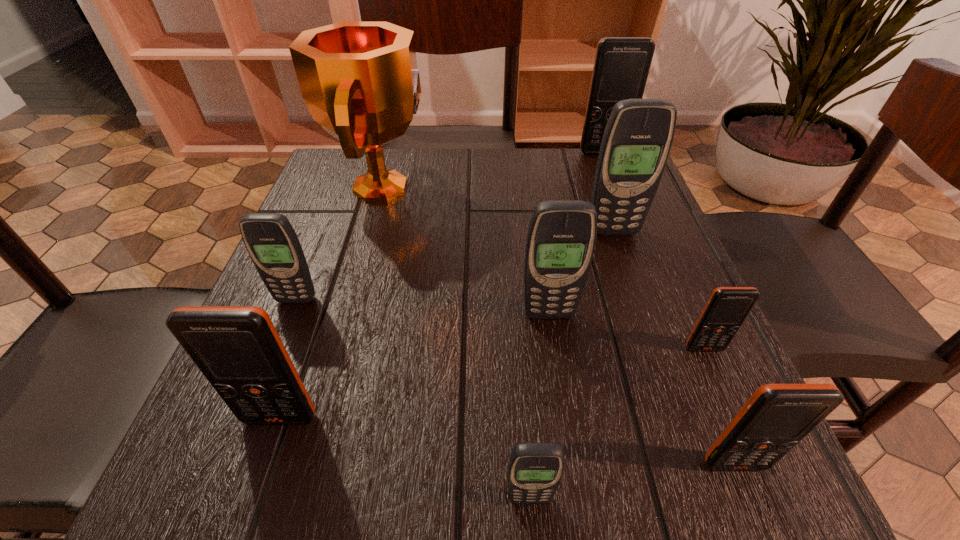
Identify the location of free spot between the sixth nearest cellular telephone and the fourth nearest cellular telephone. (500, 324).

Locate an element on the screen. The height and width of the screenshot is (540, 960). vacant region between the leftmost orange cellular telephone and the fourth farthest cellular telephone is located at coordinates (415, 366).

I want to click on vacant area that lies between the third farthest cellular telephone and the second nearest cellular telephone, so click(516, 382).

Point out which object is positioned as the nearest to the smallest orange cellular telephone. Please provide its 2D coordinates. Your answer should be formatted as a tuple, i.e. [(x, y)], where the tuple contains the x and y coordinates of a point satisfying the conditions above.

[(777, 417)]

Locate an element on the screen. the sixth closest object to the seventh farthest cellular telephone is located at coordinates (359, 80).

Where is `the second closest cellular telephone to the nearest orange cellular telephone`? The image size is (960, 540). the second closest cellular telephone to the nearest orange cellular telephone is located at coordinates (535, 470).

Point out which cellular telephone is positioned as the nearest to the nearest orange cellular telephone. Please provide its 2D coordinates. Your answer should be formatted as a tuple, i.e. [(x, y)], where the tuple contains the x and y coordinates of a point satisfying the conditions above.

[(727, 308)]

At what (x,y) coordinates should I click in order to perform the action: click on orange cellular telephone identified as the fourth closest to the rightmost gray cellular telephone. Please return your answer as a coordinate pair (x, y). This screenshot has height=540, width=960. Looking at the image, I should click on (237, 348).

Select which orange cellular telephone appears as the second closest to the nearest orange cellular telephone. Please provide its 2D coordinates. Your answer should be formatted as a tuple, i.e. [(x, y)], where the tuple contains the x and y coordinates of a point satisfying the conditions above.

[(237, 348)]

This screenshot has width=960, height=540. What are the coordinates of `gray cellular telephone object that ranks as the fourth closest to the third biggest orange cellular telephone` in the screenshot? It's located at (272, 243).